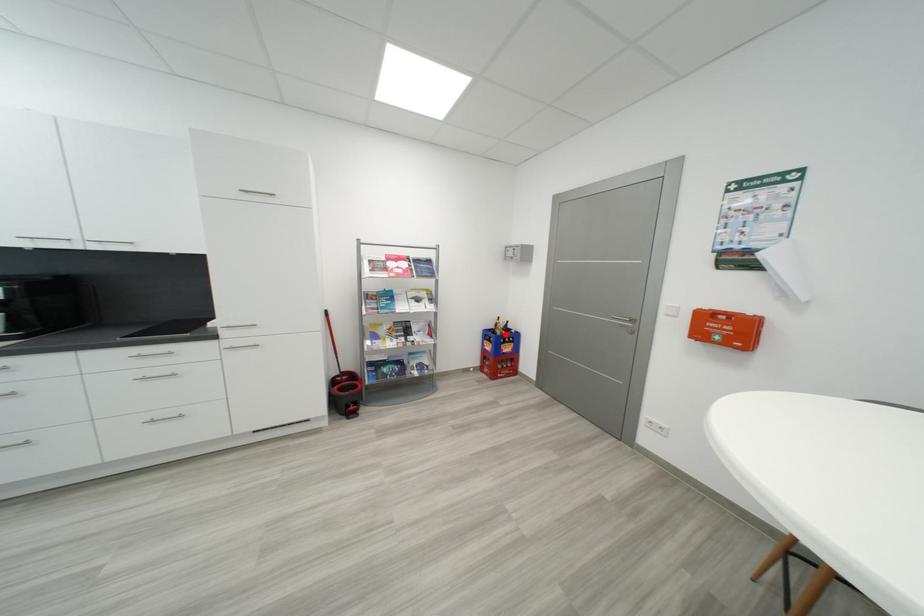
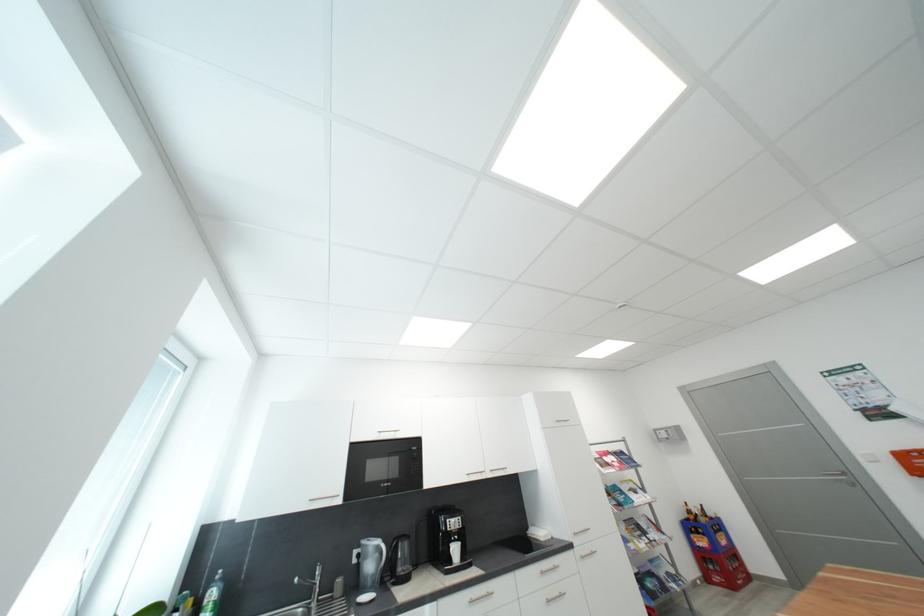
Find the pixel in the second image that matches the highlighted location in the first image.

(710, 522)